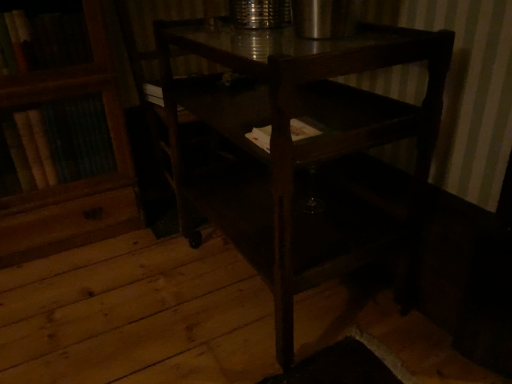
Question: Is dark wood table at center turned away from white paper at center?

Choices:
 (A) yes
 (B) no

Answer: (B)

Question: From a real-world perspective, is dark wood table at center below white paper at center?

Choices:
 (A) yes
 (B) no

Answer: (A)

Question: Does dark wood table at center have a lesser height compared to white paper at center?

Choices:
 (A) no
 (B) yes

Answer: (A)

Question: Is dark wood table at center not within white paper at center?

Choices:
 (A) yes
 (B) no

Answer: (A)

Question: Does dark wood table at center appear on the right side of white paper at center?

Choices:
 (A) no
 (B) yes

Answer: (B)

Question: Is the position of dark wood table at center more distant than that of white paper at center?

Choices:
 (A) yes
 (B) no

Answer: (B)

Question: From a real-world perspective, is white paper at center positioned over dark wood table at center based on gravity?

Choices:
 (A) no
 (B) yes

Answer: (B)

Question: Is white paper at center thinner than dark wood table at center?

Choices:
 (A) no
 (B) yes

Answer: (B)

Question: From the image's perspective, does white paper at center appear higher than dark wood table at center?

Choices:
 (A) yes
 (B) no

Answer: (A)

Question: Is white paper at center turned away from dark wood table at center?

Choices:
 (A) yes
 (B) no

Answer: (A)

Question: Is white paper at center further to the viewer compared to dark wood table at center?

Choices:
 (A) no
 (B) yes

Answer: (B)

Question: Can dark wood table at center be found inside white paper at center?

Choices:
 (A) no
 (B) yes

Answer: (A)

Question: From a real-world perspective, is dark wood table at center positioned above or below white paper at center?

Choices:
 (A) below
 (B) above

Answer: (A)